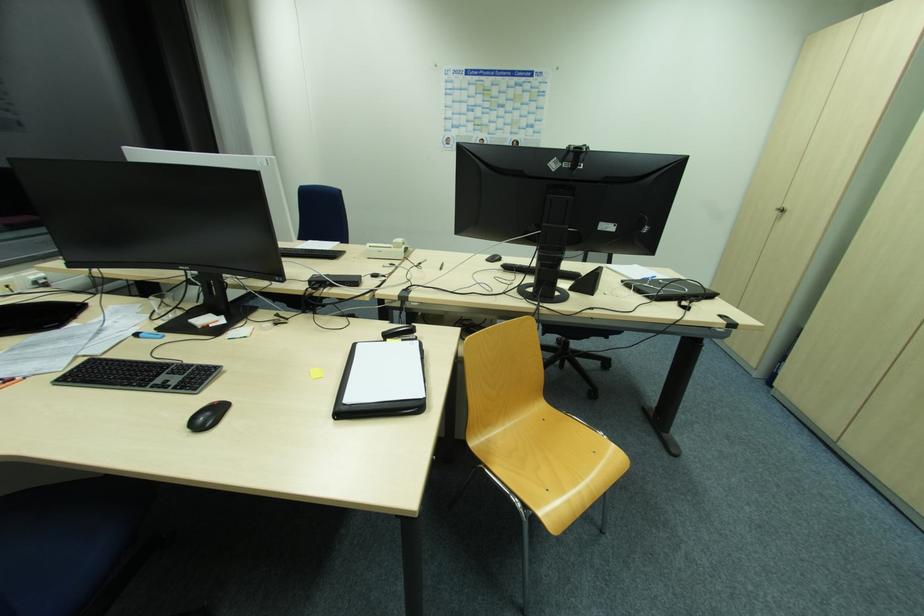
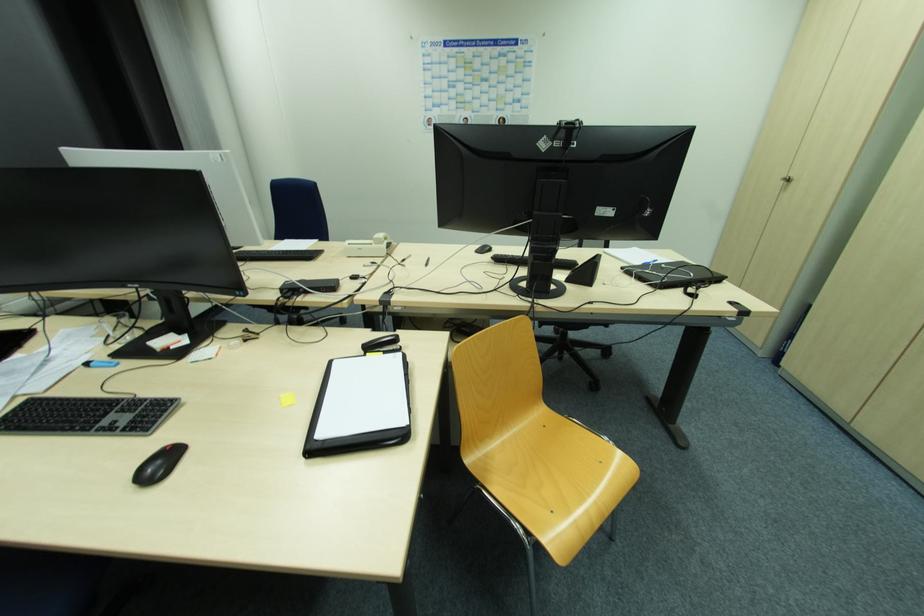
In the second image, find the point that corresponds to (x=779, y=214) in the first image.

(784, 183)